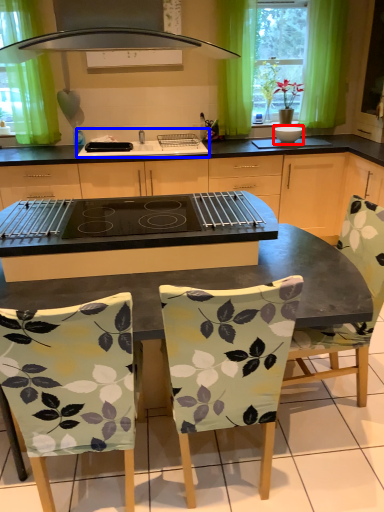
Question: Which point is further to the camera, appliance (highlighted by a red box) or sink (highlighted by a blue box)?

Choices:
 (A) appliance
 (B) sink

Answer: (A)